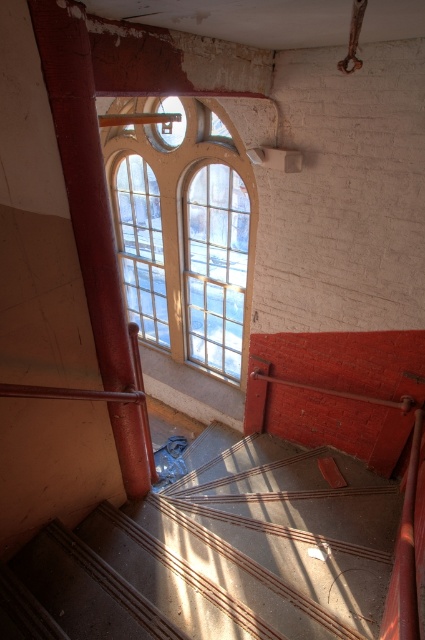
You are standing at the bottom of the staircase and want to look up towards the clear glass window at center. Which direction should you turn to see the concrete textured stairs at center first?

You should turn to your right because the concrete textured stairs at center are located to the right of the clear glass window at center.

You are standing at the bottom of the staircase and want to move towards the landing area. There are two points marked on the wall near the staircase. Which point, point (309,474) or point (105,141), is closer to you as you ascend the stairs?

Point (309,474) is closer to the viewer than point (105,141), so as you ascend the stairs, point (309,474) will be closer to you.

You are an interior designer planning to install a new lighting fixture. You have two options based on the space available between the concrete textured stairs at center and the clear glass window at center. Which object would you choose to place the fixture near if you want it to be in a larger space?

The clear glass window at center occupies more space than the concrete textured stairs at center, so placing the lighting fixture near the clear glass window at center would be better due to the larger available space.